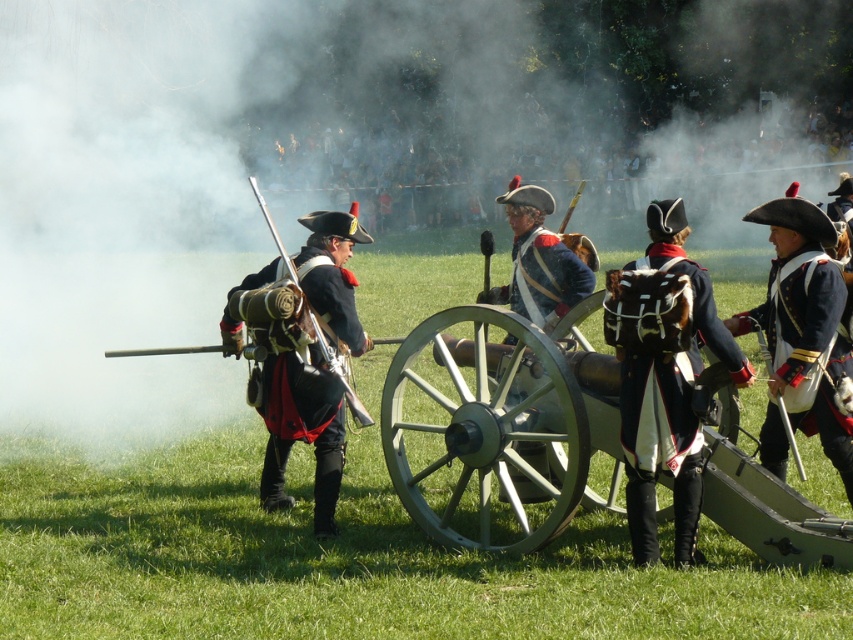
Image resolution: width=853 pixels, height=640 pixels. What do you see at coordinates (498, 429) in the screenshot?
I see `green wooden cannon at center` at bounding box center [498, 429].

Which is behind, point (444, 452) or point (689, 548)?

Positioned behind is point (444, 452).

Identify the location of green wooden cannon at center. (498, 429).

Who is higher up, green wooden cannon at center or shiny blue fabric uniform at right?

Positioned higher is shiny blue fabric uniform at right.

At what (x,y) coordinates should I click in order to perform the action: click on green wooden cannon at center. Please return your answer as a coordinate pair (x, y). The height and width of the screenshot is (640, 853). Looking at the image, I should click on click(498, 429).

Locate an element on the screen. The height and width of the screenshot is (640, 853). green wooden cannon at center is located at coordinates (498, 429).

Is green wooden cannon at center above black leather uniform at center?

Incorrect, green wooden cannon at center is not positioned above black leather uniform at center.

Does point (715, 513) come farther from viewer compared to point (263, 372)?

No, it is not.

You are a GUI agent. You are given a task and a screenshot of the screen. Output one action in this format:
    pyautogui.click(x=<x>, y=<y>)
    Task: Click on the green wooden cannon at center
    Image resolution: width=853 pixels, height=640 pixels.
    Given the screenshot: What is the action you would take?
    pyautogui.click(x=498, y=429)